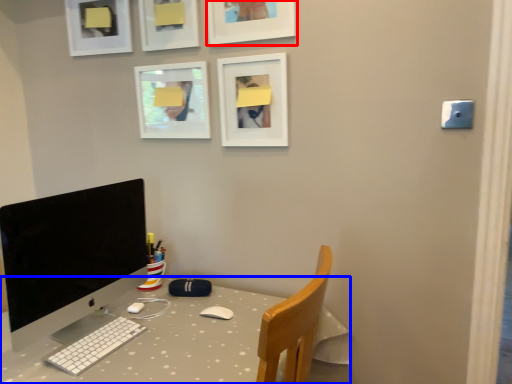
Question: Which point is further to the camera, picture frame (highlighted by a red box) or desk (highlighted by a blue box)?

Choices:
 (A) picture frame
 (B) desk

Answer: (A)